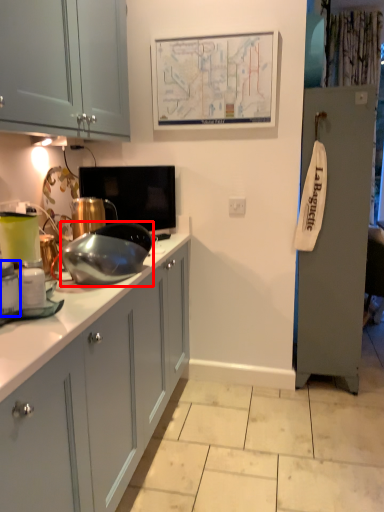
Question: Which point is further to the camera, appliance (highlighted by a red box) or kitchen appliance (highlighted by a blue box)?

Choices:
 (A) appliance
 (B) kitchen appliance

Answer: (A)